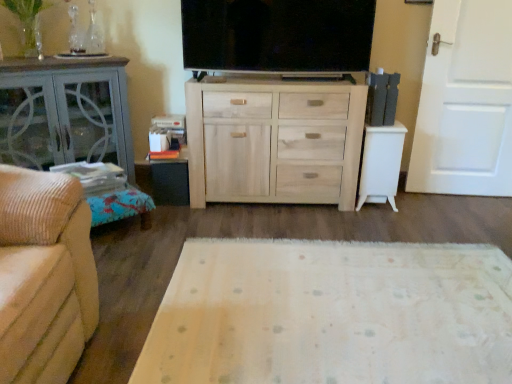
Describe the element at coordinates (381, 164) in the screenshot. This screenshot has width=512, height=384. I see `white glossy side table at right, the 3th table in the left-to-right sequence` at that location.

What is the approximate width of flat screen tv at center?

The width of flat screen tv at center is 6.38 inches.

Measure the distance between point (113, 158) and camera.

The distance of point (113, 158) from camera is 8.76 feet.

What do you see at coordinates (274, 141) in the screenshot? Image resolution: width=512 pixels, height=384 pixels. I see `light wood/unfinished chest of drawers at center` at bounding box center [274, 141].

Measure the distance between point (x=178, y=190) and camera.

Point (x=178, y=190) and camera are 2.78 meters apart from each other.

The width and height of the screenshot is (512, 384). Identify the location of white glossy side table at right, the 1th table from the right. (381, 164).

Can you confirm if matte gray cabinet at left, placed as the third table when sorted from right to left, is positioned to the right of black matte table at lower left, placed as the second table when sorted from right to left?

Incorrect, matte gray cabinet at left, placed as the third table when sorted from right to left, is not on the right side of black matte table at lower left, placed as the second table when sorted from right to left.

Is the surface of matte gray cabinet at left, placed as the third table when sorted from right to left, in direct contact with black matte table at lower left, the second table positioned from the left?

No, matte gray cabinet at left, placed as the third table when sorted from right to left, is not making contact with black matte table at lower left, the second table positioned from the left.

Is matte gray cabinet at left, the first table viewed from the left, positioned with its back to black matte table at lower left, placed as the second table when sorted from right to left?

No, matte gray cabinet at left, the first table viewed from the left, is not facing away from black matte table at lower left, placed as the second table when sorted from right to left.

Is point (117, 59) more distant than point (172, 167)?

No, it is not.

Considering the sizes of objects black matte table at lower left, placed as the second table when sorted from right to left, and matte gray cabinet at left, the first table viewed from the left, in the image provided, who is bigger, black matte table at lower left, placed as the second table when sorted from right to left, or matte gray cabinet at left, the first table viewed from the left,?

matte gray cabinet at left, the first table viewed from the left, is bigger.

From the image's perspective, which one is positioned lower, black matte table at lower left, placed as the second table when sorted from right to left, or matte gray cabinet at left, placed as the third table when sorted from right to left?

black matte table at lower left, placed as the second table when sorted from right to left, from the image's perspective.

Considering the sizes of objects black matte table at lower left, placed as the second table when sorted from right to left, and matte gray cabinet at left, placed as the third table when sorted from right to left, in the image provided, who is shorter, black matte table at lower left, placed as the second table when sorted from right to left, or matte gray cabinet at left, placed as the third table when sorted from right to left,?

Standing shorter between the two is black matte table at lower left, placed as the second table when sorted from right to left.

Which point is more distant from viewer, (156, 167) or (111, 132)?

The point (156, 167) is farther from the camera.

How many degrees apart are the facing directions of white wooden door at right and white glossy side table at right, the 1th table from the right?

The angle between the facing direction of white wooden door at right and the facing direction of white glossy side table at right, the 1th table from the right, is 3.99 degrees.

Which object is wider, white wooden door at right or white glossy side table at right, the 1th table from the right?

Wider between the two is white glossy side table at right, the 1th table from the right.

Considering the sizes of white wooden door at right and white glossy side table at right, the 3th table in the left-to-right sequence, in the image, is white wooden door at right bigger or smaller than white glossy side table at right, the 3th table in the left-to-right sequence,?

In the image, white wooden door at right appears to be larger than white glossy side table at right, the 3th table in the left-to-right sequence.

From the image's perspective, which is above, white wooden door at right or white glossy side table at right, the 3th table in the left-to-right sequence?

white wooden door at right.

Could you tell me if matte gray cabinet at left, placed as the third table when sorted from right to left, is turned towards white glossy side table at right, the 3th table in the left-to-right sequence?

No.

From the image's perspective, is matte gray cabinet at left, placed as the third table when sorted from right to left, below white glossy side table at right, the 1th table from the right?

No.

Considering the relative positions of matte gray cabinet at left, the first table viewed from the left, and white glossy side table at right, the 1th table from the right, in the image provided, is matte gray cabinet at left, the first table viewed from the left, to the left or to the right of white glossy side table at right, the 1th table from the right,?

From the image, it's evident that matte gray cabinet at left, the first table viewed from the left, is to the left of white glossy side table at right, the 1th table from the right.

Does matte gray cabinet at left, the first table viewed from the left, have a greater width compared to white glossy side table at right, the 1th table from the right?

Indeed, matte gray cabinet at left, the first table viewed from the left, has a greater width compared to white glossy side table at right, the 1th table from the right.

From a real-world perspective, is white wooden door at right positioned above or below matte gray cabinet at left, the first table viewed from the left?

white wooden door at right is above matte gray cabinet at left, the first table viewed from the left.

In the scene shown: Considering the relative sizes of white wooden door at right and matte gray cabinet at left, placed as the third table when sorted from right to left, in the image provided, is white wooden door at right smaller than matte gray cabinet at left, placed as the third table when sorted from right to left,?

Correct, white wooden door at right occupies less space than matte gray cabinet at left, placed as the third table when sorted from right to left.

Which is behind, white wooden door at right or matte gray cabinet at left, the first table viewed from the left?

white wooden door at right is behind.

Is white wooden door at right far away from matte gray cabinet at left, placed as the third table when sorted from right to left?

white wooden door at right is far away from matte gray cabinet at left, placed as the third table when sorted from right to left.

Based on the photo, is matte gray cabinet at left, placed as the third table when sorted from right to left, at the back of flat screen tv at center?

No, flat screen tv at center is not facing the opposite direction of matte gray cabinet at left, placed as the third table when sorted from right to left.

Is point (350, 39) closer to viewer compared to point (5, 88)?

No.

Could you measure the distance between flat screen tv at center and matte gray cabinet at left, the first table viewed from the left?

A distance of 33.62 inches exists between flat screen tv at center and matte gray cabinet at left, the first table viewed from the left.

Based on their sizes in the image, would you say flat screen tv at center is bigger or smaller than matte gray cabinet at left, the first table viewed from the left?

flat screen tv at center is smaller than matte gray cabinet at left, the first table viewed from the left.

Who is taller, light wood/unfinished chest of drawers at center or matte gray cabinet at left, placed as the third table when sorted from right to left?

Standing taller between the two is matte gray cabinet at left, placed as the third table when sorted from right to left.

Based on the photo, is light wood/unfinished chest of drawers at center in contact with matte gray cabinet at left, the first table viewed from the left?

No.

Does light wood/unfinished chest of drawers at center turn towards matte gray cabinet at left, placed as the third table when sorted from right to left?

No, light wood/unfinished chest of drawers at center is not turned towards matte gray cabinet at left, placed as the third table when sorted from right to left.

Does point (193, 123) appear closer or farther from the camera than point (80, 139)?

Point (193, 123) appears to be closer to the viewer than point (80, 139).

The width and height of the screenshot is (512, 384). Find the location of `table that is the 2nd one when counting forward from the black matte table at lower left, placed as the second table when sorted from right to left`. table that is the 2nd one when counting forward from the black matte table at lower left, placed as the second table when sorted from right to left is located at coordinates (65, 113).

Locate an element on the screen. The height and width of the screenshot is (384, 512). table that is the 2nd one when counting downward from the matte gray cabinet at left, placed as the third table when sorted from right to left (from the image's perspective) is located at coordinates click(170, 179).

From the image, which object appears to be farther from white glossy side table at right, the 1th table from the right, light wood/unfinished chest of drawers at center or flat screen tv at center?

Based on the image, flat screen tv at center appears to be further to white glossy side table at right, the 1th table from the right.

Estimate the real-world distances between objects in this image. Which object is further from black matte table at lower left, the second table positioned from the left, flat screen tv at center or white wooden door at right?

Among the two, white wooden door at right is located further to black matte table at lower left, the second table positioned from the left.

From the image, which object appears to be farther from white glossy side table at right, the 1th table from the right, light wood/unfinished chest of drawers at center or matte gray cabinet at left, the first table viewed from the left?

Based on the image, matte gray cabinet at left, the first table viewed from the left, appears to be further to white glossy side table at right, the 1th table from the right.

When comparing their distances from light wood/unfinished chest of drawers at center, does flat screen tv at center or black matte table at lower left, the second table positioned from the left, seem further?

black matte table at lower left, the second table positioned from the left.

Based on their spatial positions, is white glossy side table at right, the 3th table in the left-to-right sequence, or black matte table at lower left, the second table positioned from the left, closer to light wood/unfinished chest of drawers at center?

white glossy side table at right, the 3th table in the left-to-right sequence, is positioned closer to the anchor light wood/unfinished chest of drawers at center.

Which object lies further to the anchor point light wood/unfinished chest of drawers at center, black matte table at lower left, the second table positioned from the left, or flat screen tv at center?

Based on the image, black matte table at lower left, the second table positioned from the left, appears to be further to light wood/unfinished chest of drawers at center.

Which object lies nearer to the anchor point matte gray cabinet at left, the first table viewed from the left, black matte table at lower left, placed as the second table when sorted from right to left, or flat screen tv at center?

black matte table at lower left, placed as the second table when sorted from right to left, lies closer to matte gray cabinet at left, the first table viewed from the left, than the other object.

When comparing their distances from white wooden door at right, does matte gray cabinet at left, the first table viewed from the left, or light wood/unfinished chest of drawers at center seem further?

The object further to white wooden door at right is matte gray cabinet at left, the first table viewed from the left.

This screenshot has height=384, width=512. In order to click on the chest of drawers situated between matte gray cabinet at left, placed as the third table when sorted from right to left, and white glossy side table at right, the 1th table from the right, from left to right in this screenshot , I will do `click(274, 141)`.

Identify the location of table between matte gray cabinet at left, placed as the third table when sorted from right to left, and white glossy side table at right, the 1th table from the right, from left to right. The image size is (512, 384). (170, 179).

Where is `table located between black matte table at lower left, placed as the second table when sorted from right to left, and white wooden door at right in the left-right direction`? The image size is (512, 384). table located between black matte table at lower left, placed as the second table when sorted from right to left, and white wooden door at right in the left-right direction is located at coordinates (381, 164).

This screenshot has height=384, width=512. I want to click on television between black matte table at lower left, the second table positioned from the left, and white glossy side table at right, the 1th table from the right, from left to right, so click(277, 35).